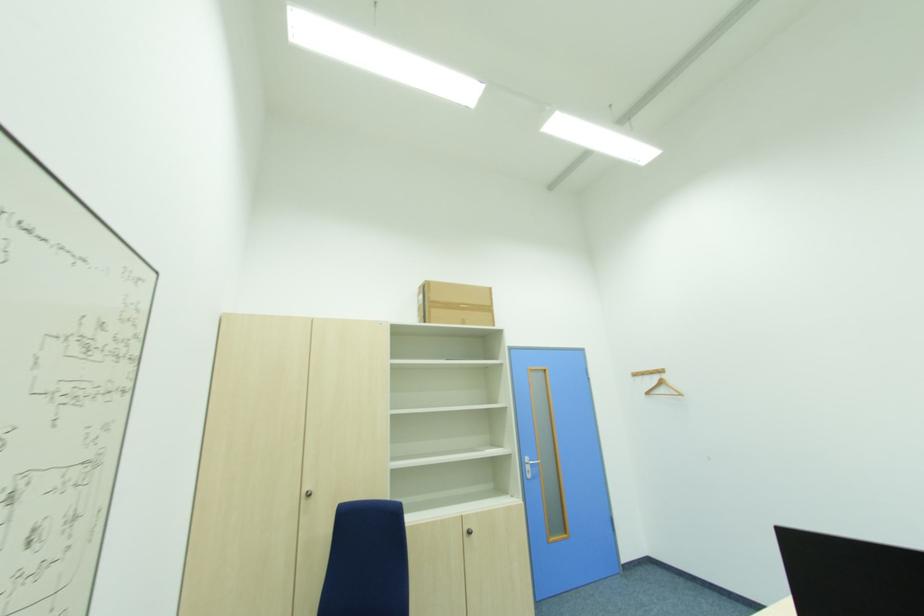
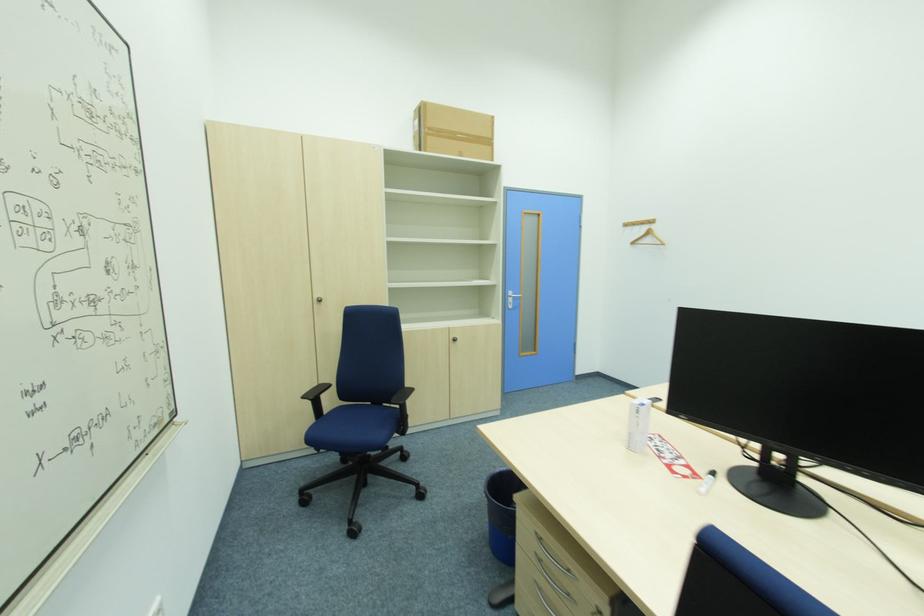
Question: The images are taken continuously from a first-person perspective. In which direction is your viewpoint rotating?

Choices:
 (A) Left
 (B) Right
 (C) Up
 (D) Down

Answer: (D)